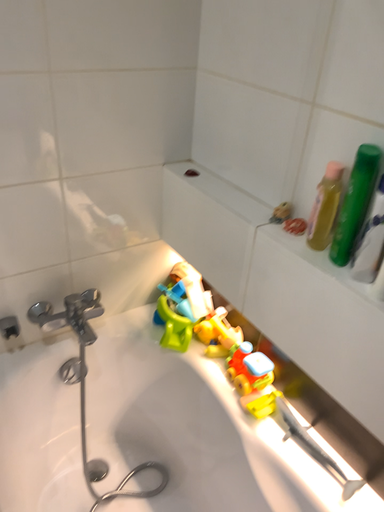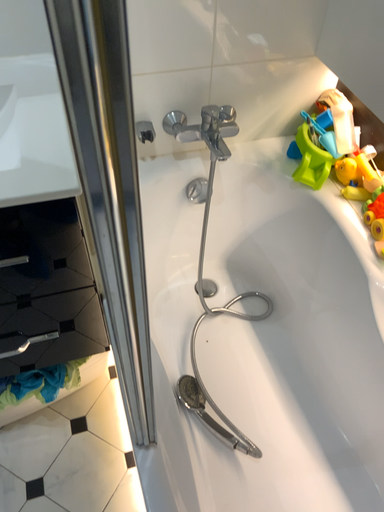
Question: How did the camera likely rotate when shooting the video?

Choices:
 (A) rotated upward
 (B) rotated downward

Answer: (B)